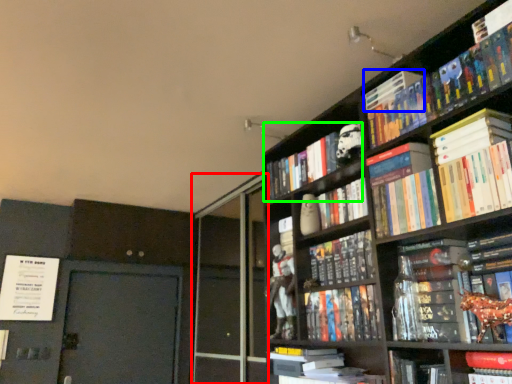
Question: Which object is the closest to the screen door (highlighted by a red box)? Choose among these: book (highlighted by a blue box) or book (highlighted by a green box).

Choices:
 (A) book
 (B) book

Answer: (B)